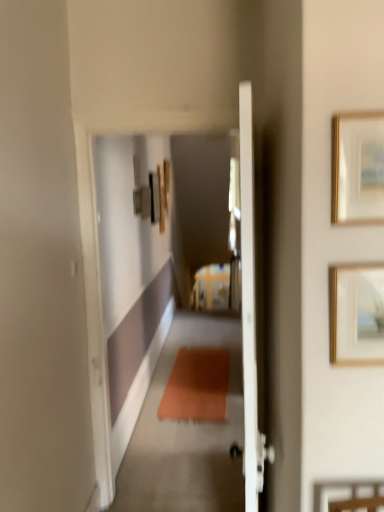
Find the location of a particular element. This screenshot has width=384, height=512. gold-framed picture at upper right, the first picture frame when ordered from top to bottom is located at coordinates (357, 168).

Describe the element at coordinates (357, 168) in the screenshot. I see `gold-framed picture at upper right, the first picture frame when ordered from top to bottom` at that location.

Locate an element on the screen. This screenshot has width=384, height=512. gold metallic picture frame at upper right, which ranks as the second picture frame in top-to-bottom order is located at coordinates (356, 314).

Describe the element at coordinates (356, 314) in the screenshot. The width and height of the screenshot is (384, 512). I see `gold metallic picture frame at upper right, which ranks as the second picture frame in top-to-bottom order` at that location.

Where is `gold-framed picture at upper right, the first picture frame when ordered from top to bottom`? The width and height of the screenshot is (384, 512). gold-framed picture at upper right, the first picture frame when ordered from top to bottom is located at coordinates (357, 168).

Can you confirm if gold-framed picture at upper right, which appears as the 2th picture frame when ordered from the bottom, is positioned to the left of gold metallic picture frame at upper right, which ranks as the second picture frame in top-to-bottom order?

Yes.

Which object is closer to the camera taking this photo, gold-framed picture at upper right, the first picture frame when ordered from top to bottom, or gold metallic picture frame at upper right, which ranks as the second picture frame in top-to-bottom order?

gold-framed picture at upper right, the first picture frame when ordered from top to bottom.

Between point (332, 125) and point (373, 307), which one is positioned in front?

Point (332, 125)

From the image's perspective, is gold-framed picture at upper right, the first picture frame when ordered from top to bottom, located above gold metallic picture frame at upper right, placed as the first picture frame when sorted from bottom to top?

Yes, from the image's perspective, gold-framed picture at upper right, the first picture frame when ordered from top to bottom, is over gold metallic picture frame at upper right, placed as the first picture frame when sorted from bottom to top.

From a real-world perspective, between gold-framed picture at upper right, the first picture frame when ordered from top to bottom, and gold metallic picture frame at upper right, placed as the first picture frame when sorted from bottom to top, who is vertically higher?

gold-framed picture at upper right, the first picture frame when ordered from top to bottom, is physically above.

Can you confirm if gold-framed picture at upper right, which appears as the 2th picture frame when ordered from the bottom, is thinner than gold metallic picture frame at upper right, placed as the first picture frame when sorted from bottom to top?

Yes, gold-framed picture at upper right, which appears as the 2th picture frame when ordered from the bottom, is thinner than gold metallic picture frame at upper right, placed as the first picture frame when sorted from bottom to top.

Is gold-framed picture at upper right, the first picture frame when ordered from top to bottom, shorter than gold metallic picture frame at upper right, placed as the first picture frame when sorted from bottom to top?

Yes.

Can you confirm if gold-framed picture at upper right, the first picture frame when ordered from top to bottom, is smaller than gold metallic picture frame at upper right, placed as the first picture frame when sorted from bottom to top?

Correct, gold-framed picture at upper right, the first picture frame when ordered from top to bottom, occupies less space than gold metallic picture frame at upper right, placed as the first picture frame when sorted from bottom to top.

Would you say gold-framed picture at upper right, which appears as the 2th picture frame when ordered from the bottom, is inside or outside gold metallic picture frame at upper right, which ranks as the second picture frame in top-to-bottom order?

gold-framed picture at upper right, which appears as the 2th picture frame when ordered from the bottom, is not inside gold metallic picture frame at upper right, which ranks as the second picture frame in top-to-bottom order, it's outside.

Would you say gold-framed picture at upper right, which appears as the 2th picture frame when ordered from the bottom, is a long distance from gold metallic picture frame at upper right, which ranks as the second picture frame in top-to-bottom order?

No, gold-framed picture at upper right, which appears as the 2th picture frame when ordered from the bottom, is not far from gold metallic picture frame at upper right, which ranks as the second picture frame in top-to-bottom order.

Consider the image. Could you tell me if gold-framed picture at upper right, which appears as the 2th picture frame when ordered from the bottom, is turned towards gold metallic picture frame at upper right, placed as the first picture frame when sorted from bottom to top?

No, gold-framed picture at upper right, which appears as the 2th picture frame when ordered from the bottom, is not turned towards gold metallic picture frame at upper right, placed as the first picture frame when sorted from bottom to top.

How much distance is there between gold-framed picture at upper right, which appears as the 2th picture frame when ordered from the bottom, and gold metallic picture frame at upper right, placed as the first picture frame when sorted from bottom to top?

gold-framed picture at upper right, which appears as the 2th picture frame when ordered from the bottom, and gold metallic picture frame at upper right, placed as the first picture frame when sorted from bottom to top, are 9.55 inches apart.

Where is `picture frame that appears below the gold-framed picture at upper right, the first picture frame when ordered from top to bottom (from the image's perspective)`? picture frame that appears below the gold-framed picture at upper right, the first picture frame when ordered from top to bottom (from the image's perspective) is located at coordinates (356, 314).

Looking at this image, which is more to the left, gold metallic picture frame at upper right, which ranks as the second picture frame in top-to-bottom order, or gold-framed picture at upper right, the first picture frame when ordered from top to bottom?

From the viewer's perspective, gold-framed picture at upper right, the first picture frame when ordered from top to bottom, appears more on the left side.

Between gold metallic picture frame at upper right, placed as the first picture frame when sorted from bottom to top, and gold-framed picture at upper right, which appears as the 2th picture frame when ordered from the bottom, which one is positioned behind?

gold metallic picture frame at upper right, placed as the first picture frame when sorted from bottom to top.

Considering the points (339, 271) and (382, 137), which point is in front, point (339, 271) or point (382, 137)?

Positioned in front is point (382, 137).

Looking at this image, from the image's perspective, which object appears higher, gold metallic picture frame at upper right, which ranks as the second picture frame in top-to-bottom order, or gold-framed picture at upper right, the first picture frame when ordered from top to bottom?

From the image's view, gold-framed picture at upper right, the first picture frame when ordered from top to bottom, is above.

From a real-world perspective, is gold metallic picture frame at upper right, which ranks as the second picture frame in top-to-bottom order, beneath gold-framed picture at upper right, which appears as the 2th picture frame when ordered from the bottom?

Yes, from a real-world perspective, gold metallic picture frame at upper right, which ranks as the second picture frame in top-to-bottom order, is below gold-framed picture at upper right, which appears as the 2th picture frame when ordered from the bottom.

Does gold metallic picture frame at upper right, which ranks as the second picture frame in top-to-bottom order, have a greater width compared to gold-framed picture at upper right, which appears as the 2th picture frame when ordered from the bottom?

Indeed, gold metallic picture frame at upper right, which ranks as the second picture frame in top-to-bottom order, has a greater width compared to gold-framed picture at upper right, which appears as the 2th picture frame when ordered from the bottom.

Does gold metallic picture frame at upper right, which ranks as the second picture frame in top-to-bottom order, have a greater height compared to gold-framed picture at upper right, which appears as the 2th picture frame when ordered from the bottom?

Indeed, gold metallic picture frame at upper right, which ranks as the second picture frame in top-to-bottom order, has a greater height compared to gold-framed picture at upper right, which appears as the 2th picture frame when ordered from the bottom.

Who is bigger, gold metallic picture frame at upper right, which ranks as the second picture frame in top-to-bottom order, or gold-framed picture at upper right, which appears as the 2th picture frame when ordered from the bottom?

gold metallic picture frame at upper right, which ranks as the second picture frame in top-to-bottom order, is bigger.

Is gold metallic picture frame at upper right, which ranks as the second picture frame in top-to-bottom order, outside of gold-framed picture at upper right, the first picture frame when ordered from top to bottom?

gold metallic picture frame at upper right, which ranks as the second picture frame in top-to-bottom order, lies outside gold-framed picture at upper right, the first picture frame when ordered from top to bottom,'s area.

Would you consider gold metallic picture frame at upper right, which ranks as the second picture frame in top-to-bottom order, to be distant from gold-framed picture at upper right, the first picture frame when ordered from top to bottom?

They are positioned close to each other.

Is gold metallic picture frame at upper right, placed as the first picture frame when sorted from bottom to top, positioned with its back to gold-framed picture at upper right, which appears as the 2th picture frame when ordered from the bottom?

gold metallic picture frame at upper right, placed as the first picture frame when sorted from bottom to top, does not have its back to gold-framed picture at upper right, which appears as the 2th picture frame when ordered from the bottom.

Where is `picture frame above the gold metallic picture frame at upper right, placed as the first picture frame when sorted from bottom to top (from the image's perspective)`? This screenshot has width=384, height=512. picture frame above the gold metallic picture frame at upper right, placed as the first picture frame when sorted from bottom to top (from the image's perspective) is located at coordinates point(357,168).

The image size is (384, 512). Find the location of `picture frame that appears above the gold metallic picture frame at upper right, placed as the first picture frame when sorted from bottom to top (from a real-world perspective)`. picture frame that appears above the gold metallic picture frame at upper right, placed as the first picture frame when sorted from bottom to top (from a real-world perspective) is located at coordinates (357, 168).

The height and width of the screenshot is (512, 384). Identify the location of picture frame below the gold-framed picture at upper right, which appears as the 2th picture frame when ordered from the bottom (from a real-world perspective). (356, 314).